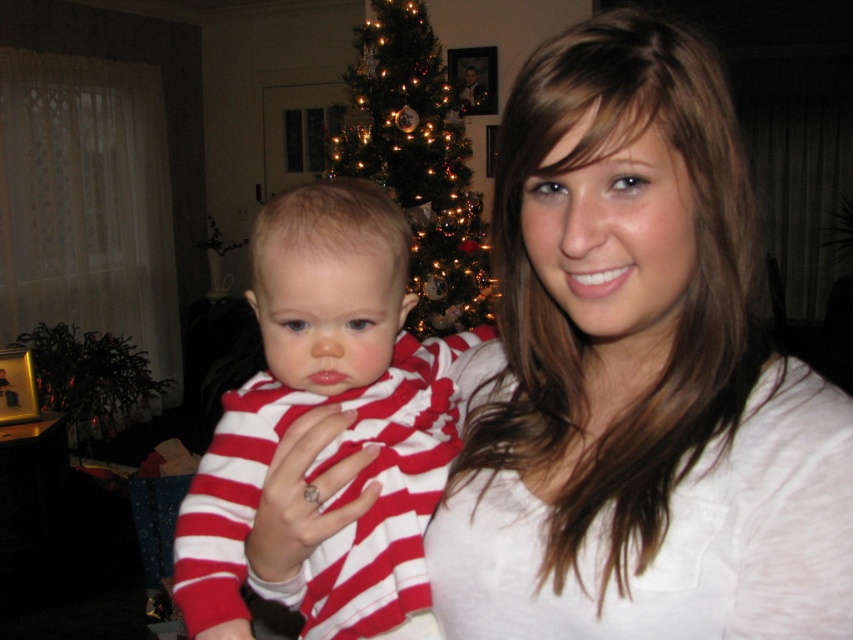
You are a photographer standing in front of the scene. You want to take a closeup shot of the white matte shirt at center without the iridescent glass ornaments at center appearing in the background. Is this possible?

The white matte shirt at center is closer to the viewer than the iridescent glass ornaments at center, so yes, you can take a closeup shot of the white matte shirt at center without the iridescent glass ornaments at center appearing in the background by focusing on the shirt and using a shallow depth of field to blur the background.

You are a photographer trying to capture a closeup shot of the baby in the red striped shirt at center. You need to ensure that the iridescent glass ornaments at center are visible in the background but not too prominent. Given the sizes of the objects, how should you adjust your camera settings to achieve this?

The red striped shirt at center is narrower than the iridescent glass ornaments at center. To make the ornaments less prominent while keeping them visible, use a wider aperture to create a shallow depth of field. This will blur the background slightly, making the baby in the red striped shirt at center the focal point while the iridescent glass ornaments at center remain visible but less sharp.